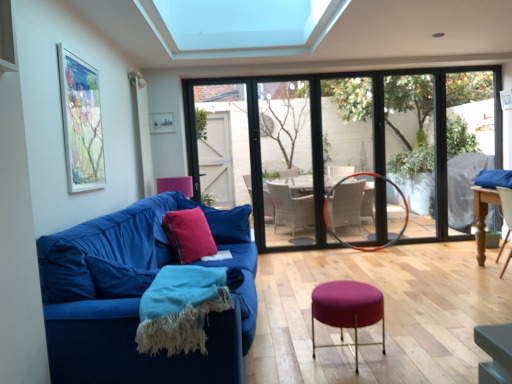
Where is `matte glass picture frame at upper center, the 2th picture frame when ordered from front to back`? matte glass picture frame at upper center, the 2th picture frame when ordered from front to back is located at coordinates (162, 122).

The height and width of the screenshot is (384, 512). What do you see at coordinates (81, 123) in the screenshot?
I see `metallic silver picture frame at upper left, arranged as the first picture frame when viewed from the front` at bounding box center [81, 123].

This screenshot has width=512, height=384. Describe the element at coordinates (483, 216) in the screenshot. I see `wooden table at right` at that location.

Where is `clear glass window screen at right`? The height and width of the screenshot is (384, 512). clear glass window screen at right is located at coordinates (412, 145).

The image size is (512, 384). Find the location of `orange metallic hula hoop at center`. orange metallic hula hoop at center is located at coordinates (347, 242).

This screenshot has height=384, width=512. In order to click on velvet blue couch at left in this screenshot , I will do `click(137, 297)`.

Where is `matte glass picture frame at upper center, positioned as the 1th picture frame in back-to-front order`? This screenshot has height=384, width=512. matte glass picture frame at upper center, positioned as the 1th picture frame in back-to-front order is located at coordinates (162, 122).

Are velvet red cushion at center left and matte glass picture frame at upper center, the 2th picture frame when ordered from front to back, located far from each other?

Indeed, velvet red cushion at center left is not near matte glass picture frame at upper center, the 2th picture frame when ordered from front to back.

Relative to matte glass picture frame at upper center, the 2th picture frame when ordered from front to back, is velvet red cushion at center left in front or behind?

velvet red cushion at center left is positioned closer to the viewer than matte glass picture frame at upper center, the 2th picture frame when ordered from front to back.

Where is `the 2nd picture frame above the velvet red cushion at center left (from the image's perspective)`? This screenshot has height=384, width=512. the 2nd picture frame above the velvet red cushion at center left (from the image's perspective) is located at coordinates (162, 122).

Is turquoise woven blanket at lower left thinner than clear glass door at center?

No, turquoise woven blanket at lower left is not thinner than clear glass door at center.

Considering the positions of objects turquoise woven blanket at lower left and clear glass door at center in the image provided, who is in front, turquoise woven blanket at lower left or clear glass door at center?

turquoise woven blanket at lower left is more forward.

Based on the photo, how many degrees apart are the facing directions of turquoise woven blanket at lower left and clear glass door at center?

There is a 178-degree angle between the facing directions of turquoise woven blanket at lower left and clear glass door at center.

Are turquoise woven blanket at lower left and clear glass door at center beside each other?

No.

Considering the positions of point (95, 84) and point (399, 235), is point (95, 84) closer or farther from the camera than point (399, 235)?

Point (95, 84) is closer to the camera than point (399, 235).

Is metallic silver picture frame at upper left, arranged as the first picture frame when viewed from the front, positioned in front of orange metallic hula hoop at center?

Yes, metallic silver picture frame at upper left, arranged as the first picture frame when viewed from the front, is closer to the viewer.

Are metallic silver picture frame at upper left, positioned as the second picture frame in back-to-front order, and orange metallic hula hoop at center far apart?

That's right, there is a large distance between metallic silver picture frame at upper left, positioned as the second picture frame in back-to-front order, and orange metallic hula hoop at center.

From a real-world perspective, is metallic silver picture frame at upper left, positioned as the second picture frame in back-to-front order, on orange metallic hula hoop at center?

Yes, from a real-world perspective, metallic silver picture frame at upper left, positioned as the second picture frame in back-to-front order, is above orange metallic hula hoop at center.

Is orange metallic hula hoop at center facing towards clear glass window screen at right?

No, orange metallic hula hoop at center is not aimed at clear glass window screen at right.

In the scene shown: Is orange metallic hula hoop at center taller or shorter than clear glass window screen at right?

orange metallic hula hoop at center is shorter than clear glass window screen at right.

From the picture: How far apart are orange metallic hula hoop at center and clear glass window screen at right?

orange metallic hula hoop at center and clear glass window screen at right are 31.85 inches apart from each other.

From the picture: Is orange metallic hula hoop at center looking in the opposite direction of clear glass door at center?

No.

From a real-world perspective, who is located lower, orange metallic hula hoop at center or clear glass door at center?

orange metallic hula hoop at center is physically lower.

Measure the distance between orange metallic hula hoop at center and clear glass door at center.

The distance of orange metallic hula hoop at center from clear glass door at center is 79.15 centimeters.

Which point is more forward, [341,304] or [183,234]?

The point [341,304] is closer.

Is purple fabric stool at center spatially inside velvet red cushion at center left, or outside of it?

purple fabric stool at center is spatially situated outside velvet red cushion at center left.

Is purple fabric stool at center oriented away from velvet red cushion at center left?

purple fabric stool at center is not turned away from velvet red cushion at center left.

Considering the sizes of wooden table at right and metallic silver picture frame at upper left, arranged as the first picture frame when viewed from the front, in the image, is wooden table at right taller or shorter than metallic silver picture frame at upper left, arranged as the first picture frame when viewed from the front,?

Clearly, wooden table at right is shorter compared to metallic silver picture frame at upper left, arranged as the first picture frame when viewed from the front.

Consider the image. Does wooden table at right appear on the left side of metallic silver picture frame at upper left, arranged as the first picture frame when viewed from the front?

No.

From a real-world perspective, is wooden table at right on metallic silver picture frame at upper left, arranged as the first picture frame when viewed from the front?

No, from a real-world perspective, wooden table at right is not over metallic silver picture frame at upper left, arranged as the first picture frame when viewed from the front

This screenshot has width=512, height=384. Identify the location of picture frame that is the 2nd one above the velvet red cushion at center left (from a real-world perspective). (162, 122).

Locate an element on the screen. The width and height of the screenshot is (512, 384). material below the clear glass door at center (from the image's perspective) is located at coordinates (181, 308).

Which object lies further to the anchor point wooden table at right, transparent glass window at center or turquoise woven blanket at lower left?

The object further to wooden table at right is turquoise woven blanket at lower left.

Looking at the image, which one is located closer to velvet red cushion at center left, pink fabric armchair at center or orange metallic hula hoop at center?

Among the two, pink fabric armchair at center is located nearer to velvet red cushion at center left.

When comparing their distances from clear glass door at center, does transparent glass window at center or wooden table at right seem closer?

transparent glass window at center is closer to clear glass door at center.

Considering their positions, is velvet red pillow at center positioned further to wooden table at right than orange metallic hula hoop at center?

Based on the image, velvet red pillow at center appears to be further to wooden table at right.

Based on their spatial positions, is velvet red cushion at center left or matte glass picture frame at upper center, positioned as the 1th picture frame in back-to-front order, closer to turquoise woven blanket at lower left?

velvet red cushion at center left is closer to turquoise woven blanket at lower left.

Based on their spatial positions, is transparent glass window at center or velvet blue couch at left further from clear glass window screen at right?

velvet blue couch at left.

Based on their spatial positions, is velvet red pillow at center or orange metallic hula hoop at center closer to purple fabric stool at center?

velvet red pillow at center is closer to purple fabric stool at center.

In the scene shown: When comparing their distances from turquoise woven blanket at lower left, does purple fabric stool at center or clear glass window screen at right seem closer?

purple fabric stool at center lies closer to turquoise woven blanket at lower left than the other object.

This screenshot has width=512, height=384. Identify the location of swivel chair between pink fabric armchair at center and wooden table at right in the horizontal direction. (347, 242).

The width and height of the screenshot is (512, 384). Identify the location of pillow between pink fabric armchair at center and clear glass window screen at right in the horizontal direction. (223, 221).

Image resolution: width=512 pixels, height=384 pixels. Find the location of `pillow between metallic silver picture frame at upper left, positioned as the second picture frame in back-to-front order, and pink fabric armchair at center in the front-back direction`. pillow between metallic silver picture frame at upper left, positioned as the second picture frame in back-to-front order, and pink fabric armchair at center in the front-back direction is located at coordinates (223, 221).

At what (x,y) coordinates should I click in order to perform the action: click on picture frame between velvet red pillow at center and clear glass door at center in the front-back direction. Please return your answer as a coordinate pair (x, y). This screenshot has width=512, height=384. Looking at the image, I should click on (162, 122).